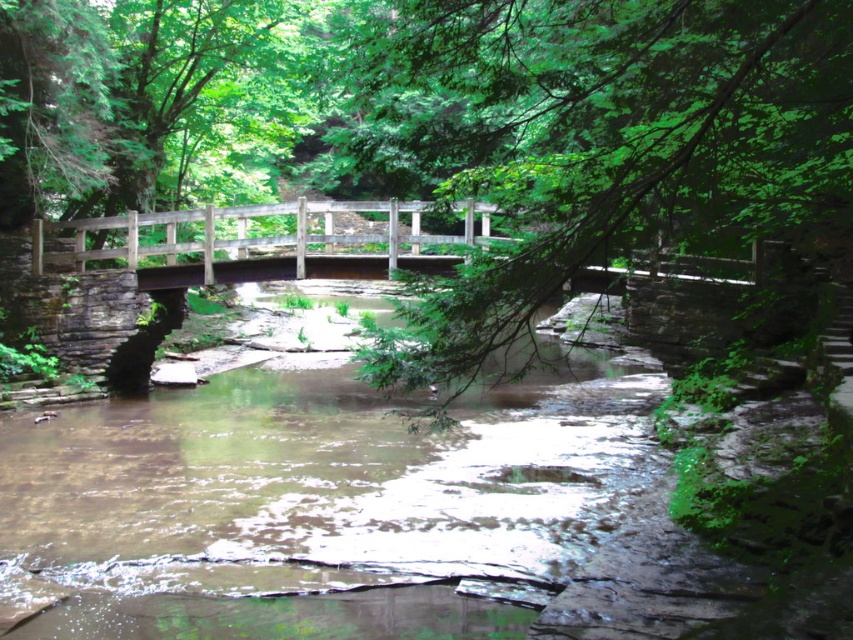
Can you confirm if green leafy branch at center is wider than wooden bridge at center?

No, green leafy branch at center is not wider than wooden bridge at center.

Between green leafy branch at center and wooden bridge at center, which one has more height?

green leafy branch at center

Does point (633, 67) lie behind point (196, 216)?

No, (633, 67) is in front of (196, 216).

At what (x,y) coordinates should I click in order to perform the action: click on green leafy branch at center. Please return your answer as a coordinate pair (x, y). The image size is (853, 640). Looking at the image, I should click on (598, 140).